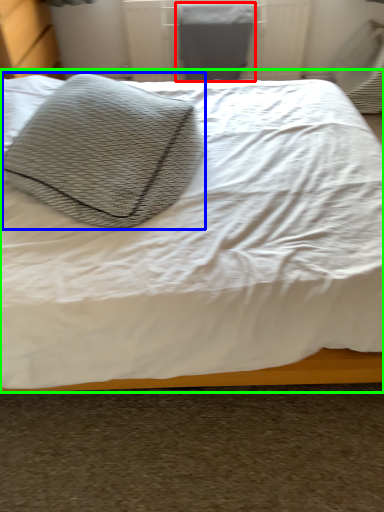
Question: Estimate the real-world distances between objects in this image. Which object is closer to gray (highlighted by a red box), throw pillow (highlighted by a blue box) or bed (highlighted by a green box)?

Choices:
 (A) throw pillow
 (B) bed

Answer: (B)